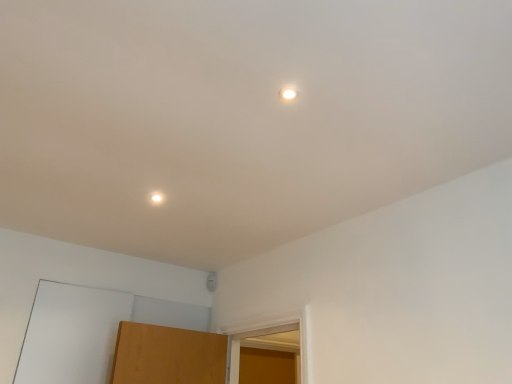
What do you see at coordinates (156, 198) in the screenshot? I see `white matte light fixture at upper center` at bounding box center [156, 198].

Locate an element on the screen. The height and width of the screenshot is (384, 512). white matte light fixture at upper center is located at coordinates click(156, 198).

From the picture: What is the approximate width of white matte light fixture at upper center?

white matte light fixture at upper center is 2.29 inches wide.

This screenshot has width=512, height=384. In order to click on white matte light fixture at upper center in this screenshot , I will do `click(156, 198)`.